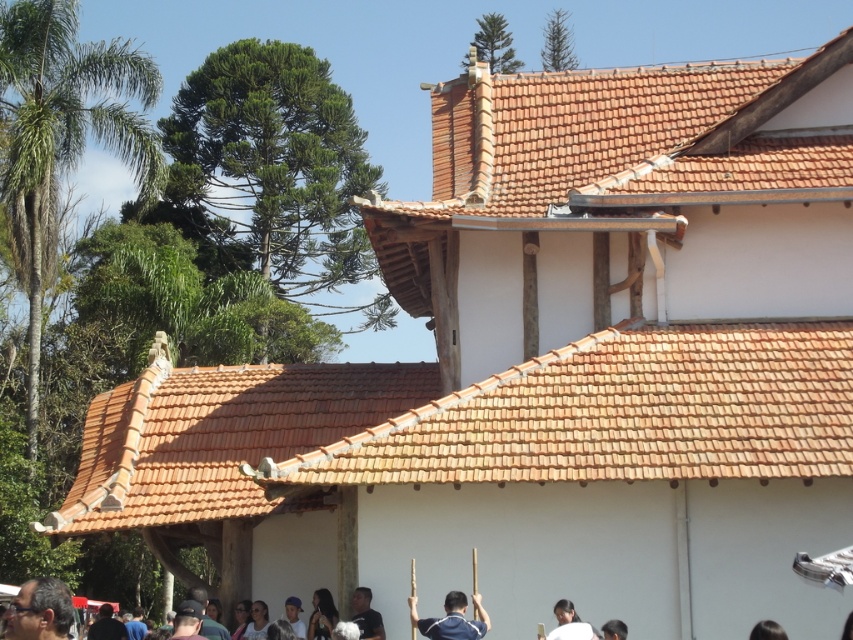
You are standing in front of the building and want to take a photo that includes both the point at coordinates point [827,420] and point [621,636]. Which point should you focus on first to ensure both are in focus?

→ You should focus on point [621,636] first because it is closer to the camera than point [827,420]. By focusing on the closer point, the depth of field may also include the farther point in focus.

You are standing at the center of the image and want to locate the dark brown hair at lower left. In which direction should you look relative to your current position?

The dark brown hair at lower left is located at point (39, 611), which means you should look to the lower left direction from your current position at the center of the image.